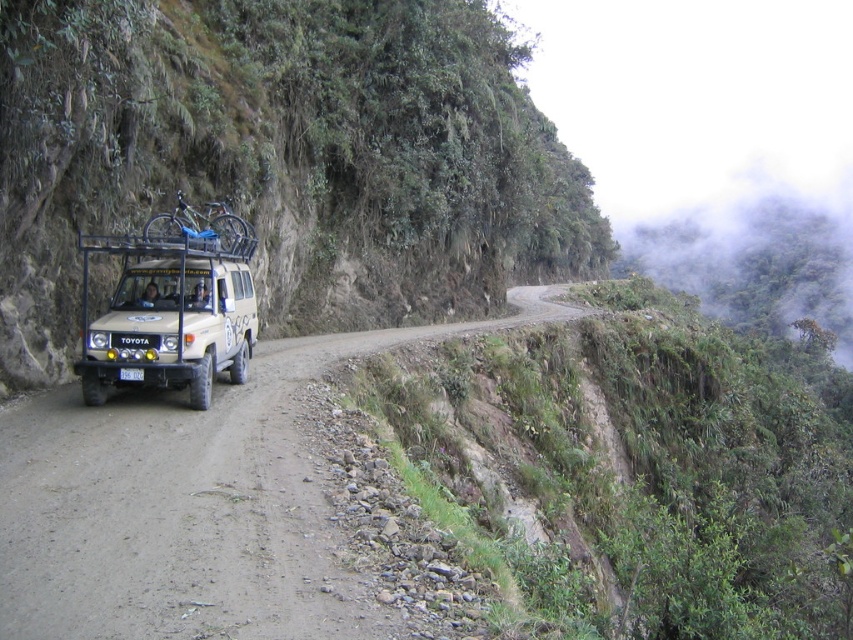
Where is `beige matte suv at center-left`? The image size is (853, 640). beige matte suv at center-left is located at coordinates (172, 312).

In the scene shown: Does beige matte suv at center-left have a greater width compared to white plastic license plate at center?

Yes.

Is point (247, 356) closer to camera compared to point (143, 371)?

No, (247, 356) is behind (143, 371).

Find the location of a particular element. The height and width of the screenshot is (640, 853). beige matte suv at center-left is located at coordinates [x=172, y=312].

Is green mossy hillside at left smaller than beige matte suv at center-left?

No.

Which is above, green mossy hillside at left or beige matte suv at center-left?

green mossy hillside at left is above.

At what (x,y) coordinates should I click in order to perform the action: click on green mossy hillside at left. Please return your answer as a coordinate pair (x, y). Looking at the image, I should click on pyautogui.click(x=282, y=157).

Which is more to the left, green mossy hillside at left or white plastic license plate at center?

white plastic license plate at center

Does green mossy hillside at left appear on the left side of white plastic license plate at center?

In fact, green mossy hillside at left is to the right of white plastic license plate at center.

Does point (187, 35) come behind point (128, 371)?

That is True.

Where is `green mossy hillside at left`? This screenshot has width=853, height=640. green mossy hillside at left is located at coordinates (282, 157).